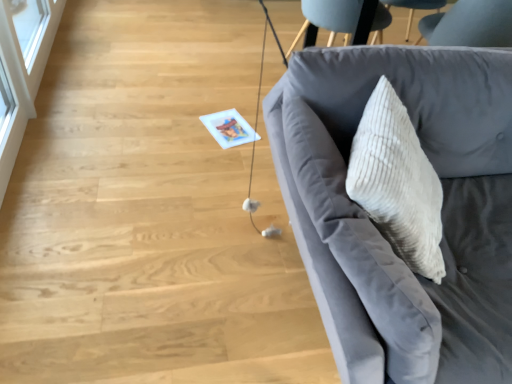
Question: From the image's perspective, would you say velvet gray couch at right is positioned over transparent glass door at upper left?

Choices:
 (A) yes
 (B) no

Answer: (B)

Question: From a real-world perspective, is velvet gray couch at right located beneath transparent glass door at upper left?

Choices:
 (A) no
 (B) yes

Answer: (A)

Question: Is velvet gray couch at right looking in the opposite direction of transparent glass door at upper left?

Choices:
 (A) no
 (B) yes

Answer: (A)

Question: Considering the relative sizes of velvet gray couch at right and transparent glass door at upper left in the image provided, is velvet gray couch at right smaller than transparent glass door at upper left?

Choices:
 (A) yes
 (B) no

Answer: (B)

Question: From a real-world perspective, is velvet gray couch at right positioned over transparent glass door at upper left based on gravity?

Choices:
 (A) no
 (B) yes

Answer: (B)

Question: From the image's perspective, would you say velvet gray couch at right is shown under transparent glass door at upper left?

Choices:
 (A) no
 (B) yes

Answer: (B)

Question: Could you tell me if transparent glass door at upper left is facing velvet gray couch at right?

Choices:
 (A) no
 (B) yes

Answer: (A)

Question: Can we say transparent glass door at upper left lies outside velvet gray couch at right?

Choices:
 (A) yes
 (B) no

Answer: (A)

Question: From a real-world perspective, is transparent glass door at upper left on velvet gray couch at right?

Choices:
 (A) no
 (B) yes

Answer: (A)

Question: Is transparent glass door at upper left at the right side of velvet gray couch at right?

Choices:
 (A) no
 (B) yes

Answer: (A)

Question: Is transparent glass door at upper left to the left of velvet gray couch at right from the viewer's perspective?

Choices:
 (A) yes
 (B) no

Answer: (A)

Question: From a real-world perspective, is transparent glass door at upper left beneath velvet gray couch at right?

Choices:
 (A) yes
 (B) no

Answer: (A)

Question: Is velvet gray couch at right in front of or behind transparent glass door at upper left in the image?

Choices:
 (A) front
 (B) behind

Answer: (A)